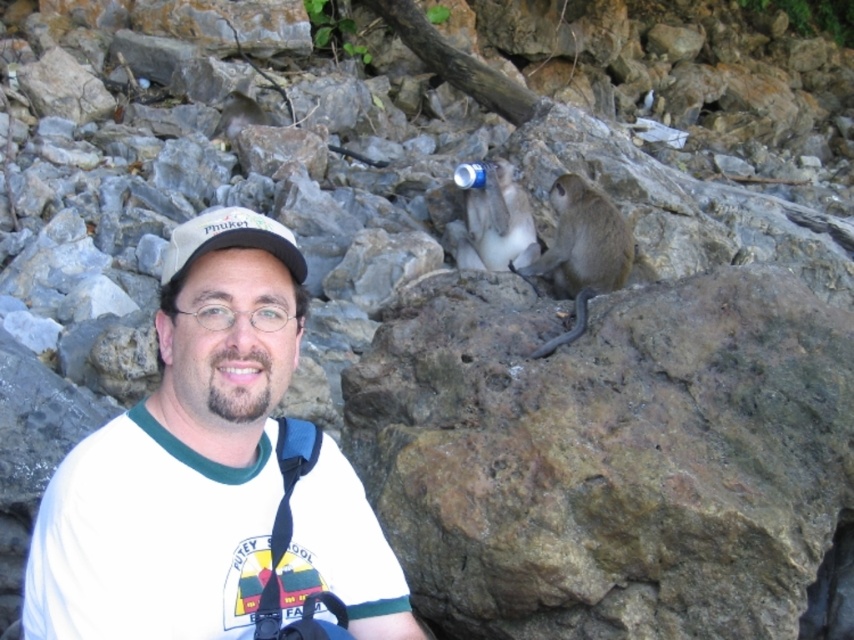
You are a photographer trying to capture a photo of the gray furry monkey at upper center and the white fabric cap at left. Based on their positions, which object is higher in the frame?

The gray furry monkey at upper center is higher in the frame than the white fabric cap at left.

You are standing at the point marked as point (x=525, y=262). The man and the two monkeys are in the scene. How far apart are the man and the monkeys?

The man and the monkeys are 6.07 meters apart.

You are a photographer standing at the point marked by the coordinates (180, 456). You want to take a photo of the man in the white t shirt with the colorful logo and the two monkeys on the rock. Will you be able to see both the man and the monkeys in your photo?

The point marked by the coordinates (180, 456) marks the white cotton shirt at left, which is part of the man in the white t shirt with the colorful logo. Since you are standing at this point, you are already positioned near the man, so you can easily capture both the man and the monkeys on the rock in the background in your photo.